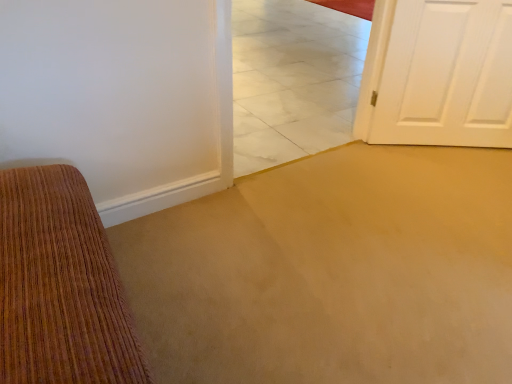
Question: Considering the positions of point (443, 16) and point (262, 109), is point (443, 16) closer or farther from the camera than point (262, 109)?

Choices:
 (A) farther
 (B) closer

Answer: (B)

Question: In the image, is white painted wood door at right on the left side or the right side of white marble tile at center?

Choices:
 (A) left
 (B) right

Answer: (B)

Question: Based on their sizes in the image, would you say white painted wood door at right is bigger or smaller than white marble tile at center?

Choices:
 (A) small
 (B) big

Answer: (A)

Question: Is point (320, 41) closer or farther from the camera than point (426, 76)?

Choices:
 (A) closer
 (B) farther

Answer: (B)

Question: From the image's perspective, is white marble tile at center located above or below white painted wood door at right?

Choices:
 (A) above
 (B) below

Answer: (B)

Question: Based on their positions, is white marble tile at center located to the left or right of white painted wood door at right?

Choices:
 (A) left
 (B) right

Answer: (A)

Question: In the image, is white marble tile at center positioned in front of or behind white painted wood door at right?

Choices:
 (A) behind
 (B) front

Answer: (B)